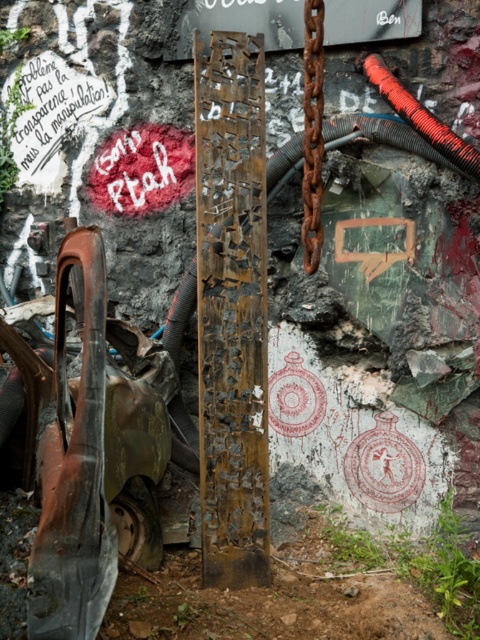
You are an urban explorer assessing the structural integrity of the scene. Given the rusty metal sign at upper center and the rusty metal chain at center, which object is wider?

The rusty metal sign at upper center is wider than the rusty metal chain at center, as its width surpasses that of the chain.

You are an urban explorer assessing safety in this area. The rusty metal sign at upper center and the rusty metal chain at center are both potential hazards. Which object is shorter in height?

The rusty metal sign at upper center is not as tall as the rusty metal chain at center, so the sign is shorter in height.